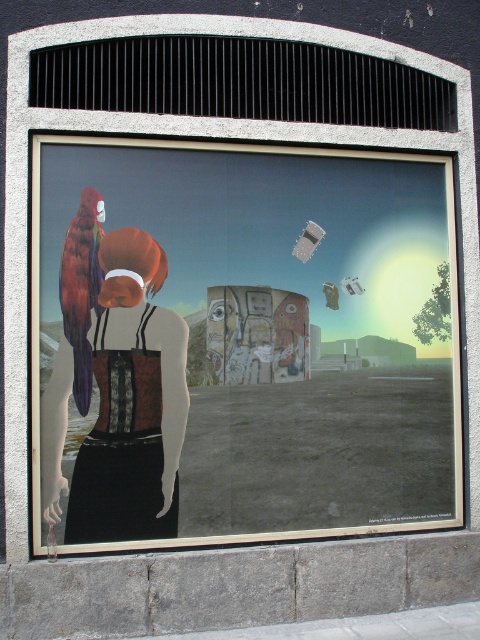
You are an art conservator examining the surrealistic artwork. You need to determine the spatial arrangement of the objects. Which object is positioned to the left of the other between the matte black corset at center and the shiny metallic parrot at left?

The shiny metallic parrot at left is positioned to the left of the matte black corset at center.

You are standing in front of the surrealistic artwork described. You want to read the text on the matte black poster at center. Considering the distance, can you read the text clearly without moving closer?

The matte black poster at center is 15.11 feet away from the viewer. At this distance, it may be difficult to read the text clearly without moving closer.